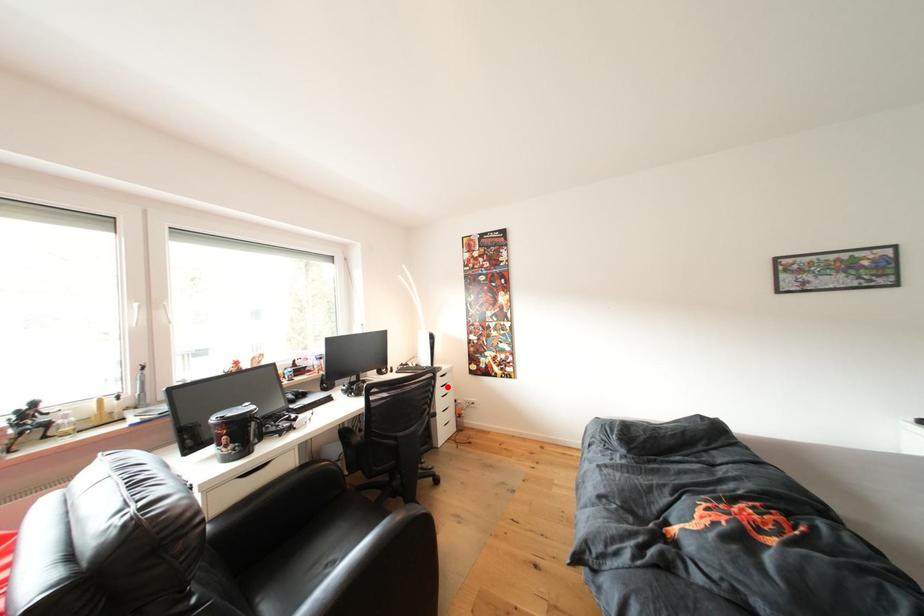
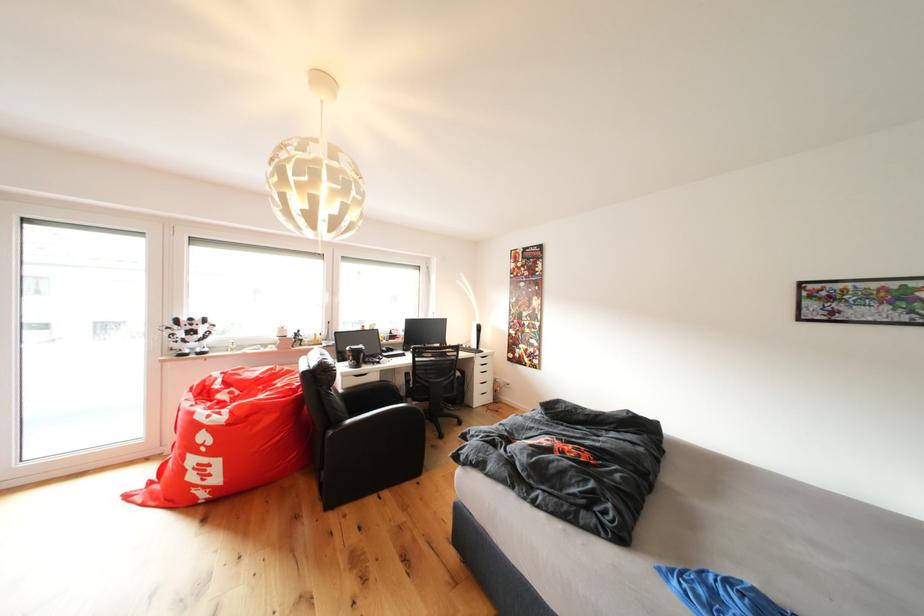
Question: I am providing you with two images of the same scene from different viewpoints. A red point is marked on the first image. Is the red point's position out of view in image 2?

Choices:
 (A) Yes
 (B) No

Answer: (B)